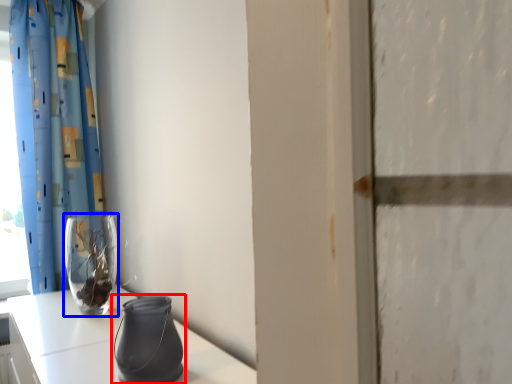
Question: Which point is closer to the camera, vase (highlighted by a red box) or vase (highlighted by a blue box)?

Choices:
 (A) vase
 (B) vase

Answer: (A)